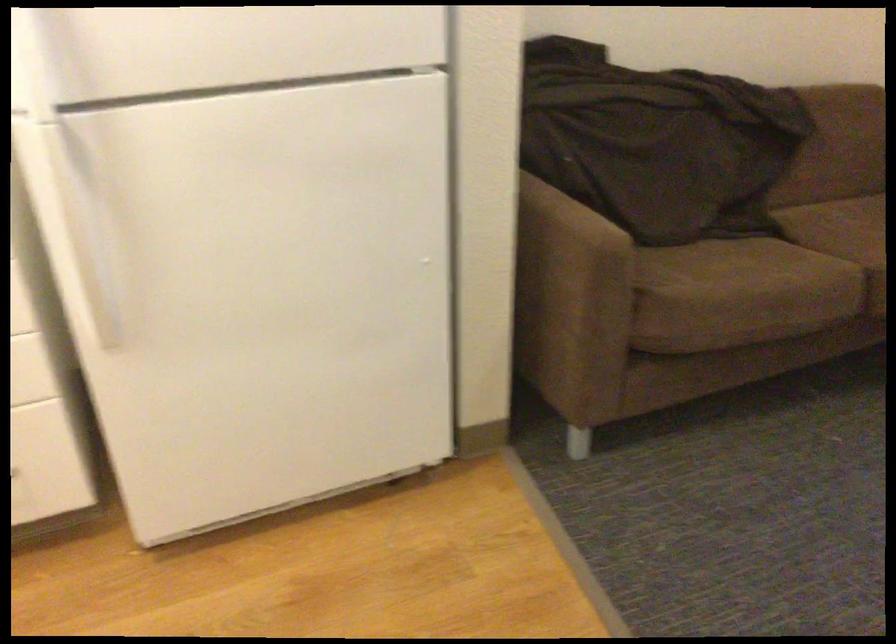
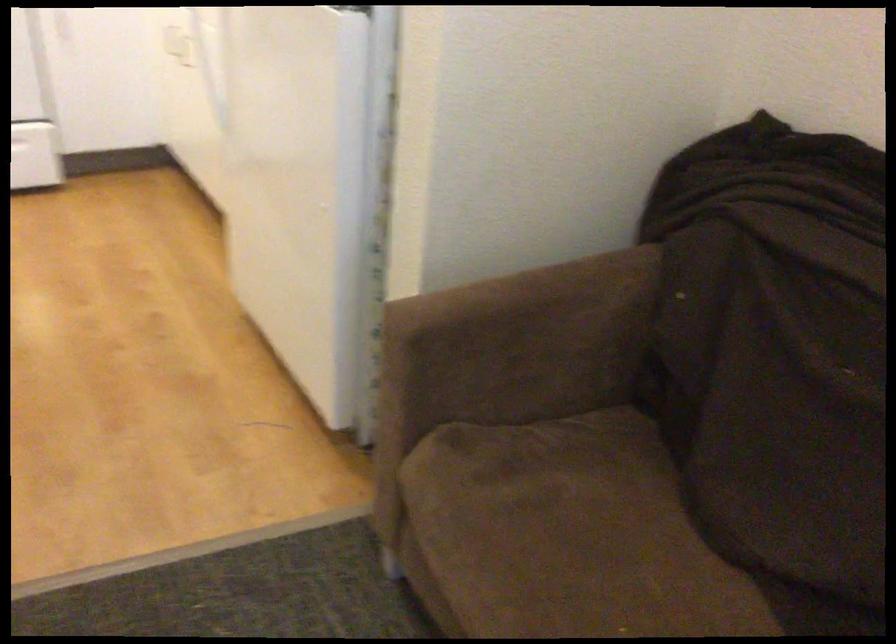
Locate, in the second image, the point that corresponds to (x=700, y=277) in the first image.

(563, 542)